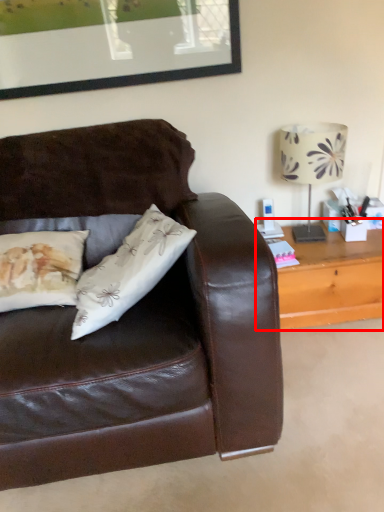
Question: From the image's perspective, considering the relative positions of table (annotated by the red box) and table lamp in the image provided, where is table (annotated by the red box) located with respect to the staircase?

Choices:
 (A) below
 (B) above

Answer: (A)